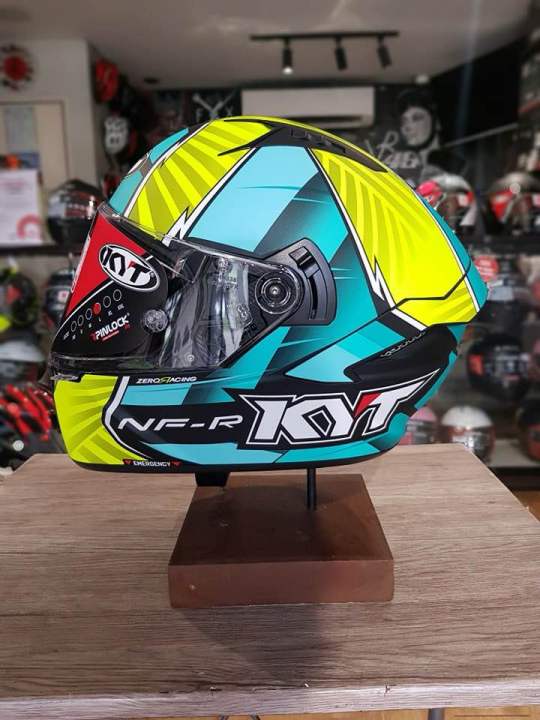
Find the location of a particular element. This screenshot has height=720, width=540. bulletin board is located at coordinates (45, 150).